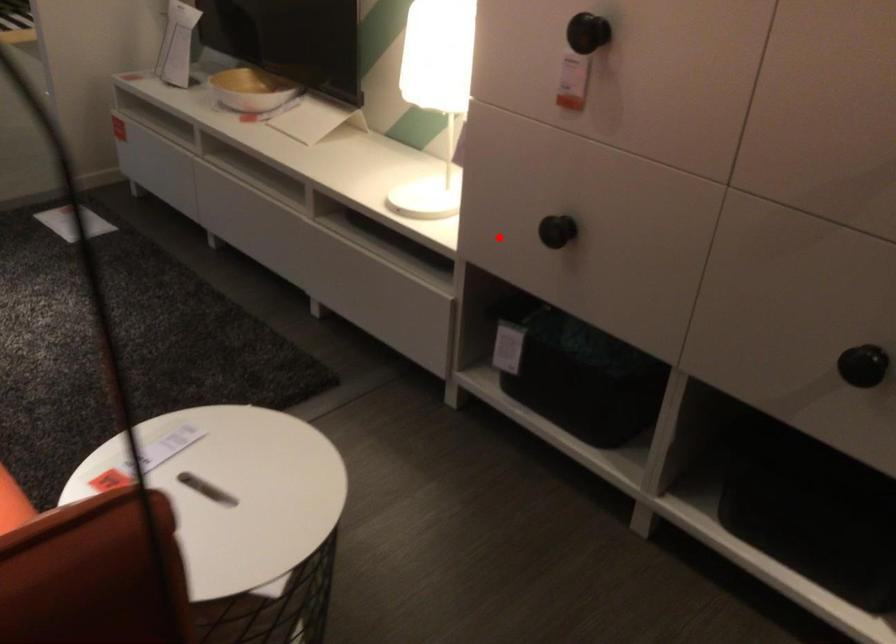
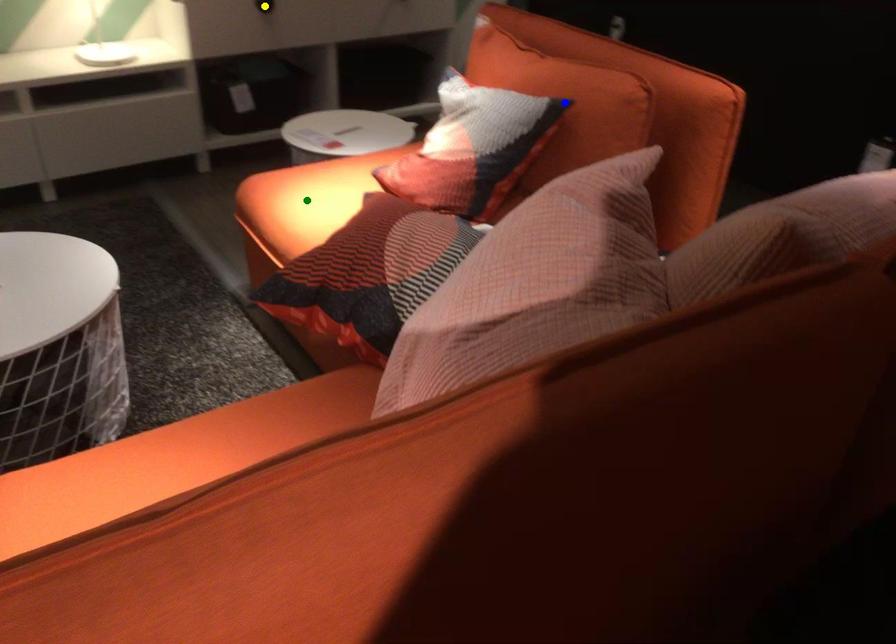
Question: I am providing you with two images of the same scene from different viewpoints. A red point is marked on the first image. You are given multiple points on the second image. Which spot in image 2 lines up with the point in image 1?

Choices:
 (A) green point
 (B) yellow point
 (C) blue point

Answer: (B)